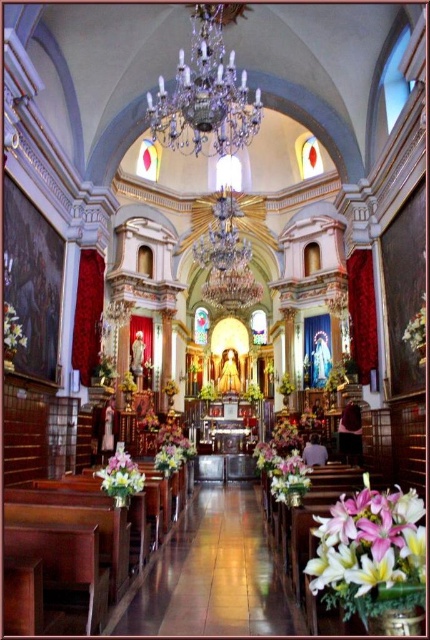
You are standing in the grand church and want to place a new decoration between the white floral arrangement at center and the pastel pink silk flowers at lower left. Based on their positions, which side should the new decoration be placed to ensure it is between them?

The new decoration should be placed to the right of the pastel pink silk flowers at lower left and to the left of the white floral arrangement at center since the white floral arrangement at center is to the right of the pastel pink silk flowers at lower left.

You are standing inside the grand church and want to place a new white floral arrangement at center. The current one is 34.44 meters away. Can you reach it without moving closer?

The white floral arrangement at center is 34.44 meters away from the viewer, so you cannot reach it without moving closer.

You are standing at the entrance of the grand church and want to place a new white floral arrangement at center. What are the coordinates where you should place it?

You should place the white floral arrangement at center at the coordinates point (283, 465).